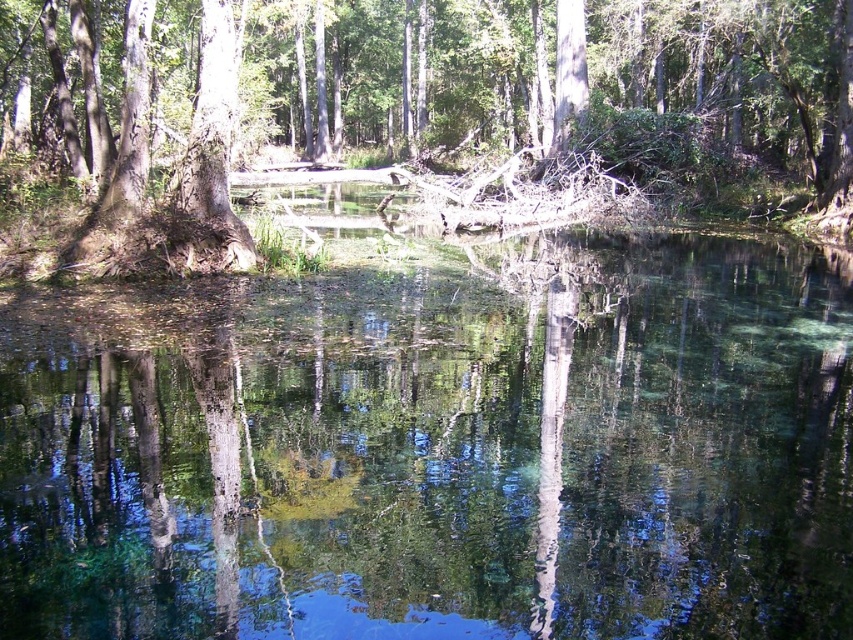
You are a hiker who wants to take a photo of the smooth bark tree at center without the clear water at center appearing in the frame. Is this possible based on their positions?

The clear water at center is in front of the smooth bark tree at center, so you cannot take a photo of the smooth bark tree at center without the clear water at center appearing in the frame since it blocks the view.

You are standing at the edge of the forest and see the point at the center of the image marked as point (440, 451). Based on the scene description, what is the most likely feature at this point?

The point at (440, 451) indicates clear water at center, so the most likely feature at this point is clear water.

Looking at this image, you are standing at the edge of the forest and see the clear water at center and the smooth bark tree at center. Which object is taller from your perspective?

The smooth bark tree at center is taller than the clear water at center.